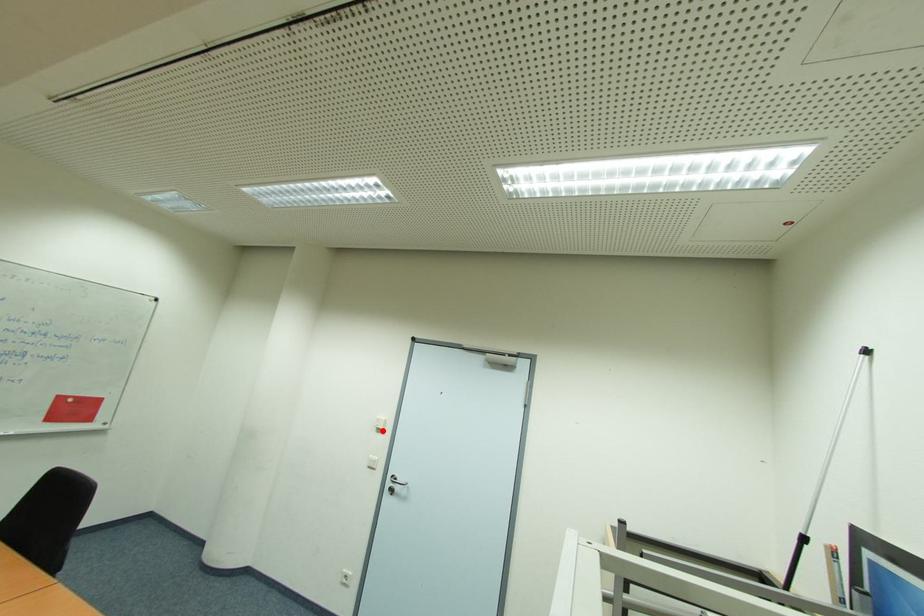
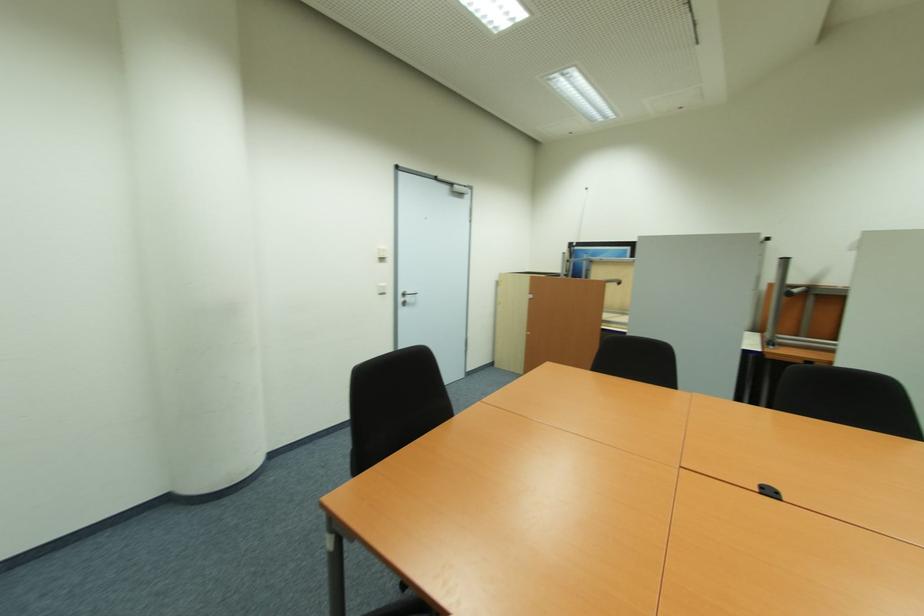
Where in the second image is the point corresponding to the highlighted location from the first image?

(385, 260)